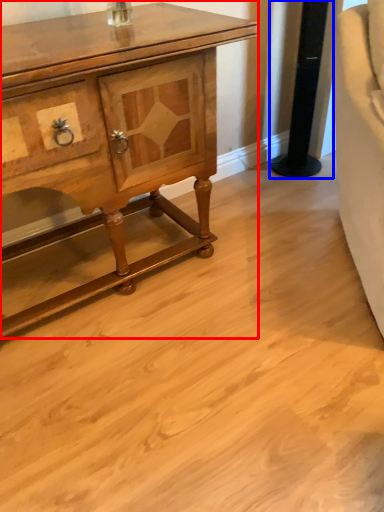
Question: Among these objects, which one is nearest to the camera, chest of drawers (highlighted by a red box) or pillar (highlighted by a blue box)?

Choices:
 (A) chest of drawers
 (B) pillar

Answer: (A)